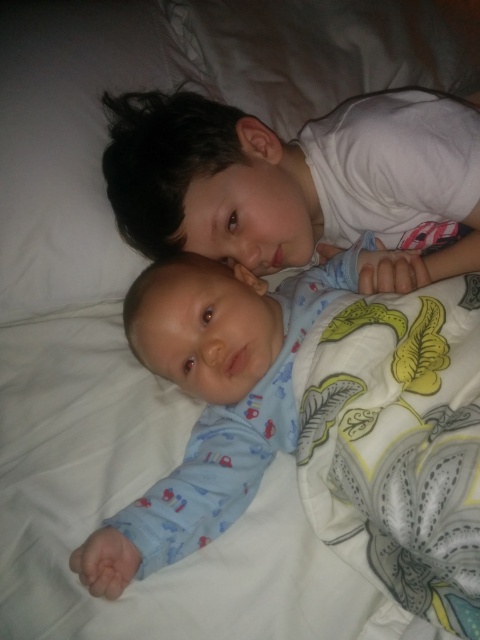
Can you confirm if white smooth shirt at upper center is shorter than blue cotton onesie at center?

Yes.

Which is below, white smooth shirt at upper center or blue cotton onesie at center?

blue cotton onesie at center

Between point (405, 284) and point (191, 477), which one is positioned behind?

Point (405, 284)

Where is `white smooth shirt at upper center`? The width and height of the screenshot is (480, 640). white smooth shirt at upper center is located at coordinates (299, 180).